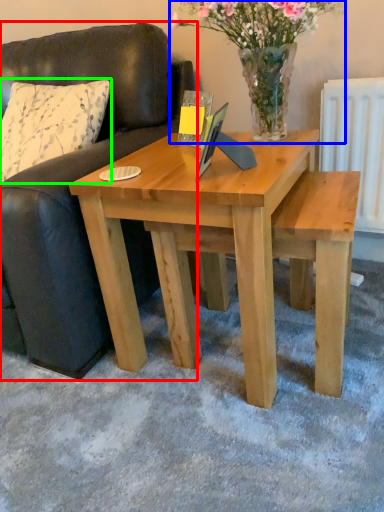
Question: Which object is the farthest from studio couch (highlighted by a red box)? Choose among these: floral arrangement (highlighted by a blue box) or pillow (highlighted by a green box).

Choices:
 (A) floral arrangement
 (B) pillow

Answer: (A)